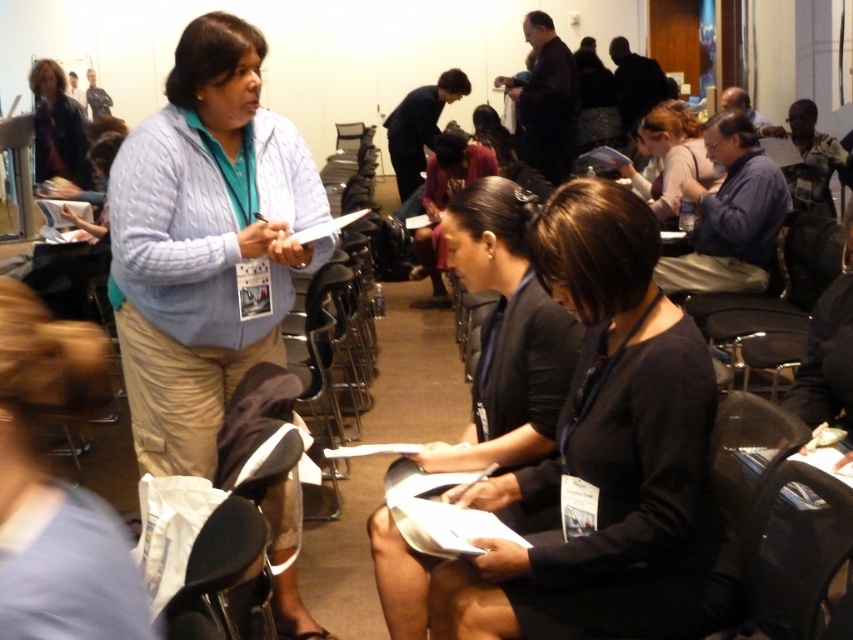
You are organizing a photo shoot and need to ensure that the black fabric shirt at center and the light blue knitted sweater at center are both visible in the frame. Given their sizes, which one might require more careful positioning to avoid being cropped out?

The light blue knitted sweater at center requires more careful positioning because it occupies more space than the black fabric shirt at center, making it more likely to be cropped out if not framed properly.

Consider the image. You are an event planner looking at the conference room layout. You notice the light blue knitted sweater at center and the matte black hair at upper right. Which object is positioned lower in the image?

The light blue knitted sweater at center is positioned below the matte black hair at upper right, so it is lower in the image.

You are organizing a photo shoot and need to arrange the light blue knitted sweater at center and the matte black jacket at upper left in a way that maintains their original heights. If you want to place them side by side on a display rack, which one should be placed on the higher shelf to match their real heights?

The light blue knitted sweater at center is much taller than the matte black jacket at upper left, so it should be placed on the higher shelf to maintain their original height relationship.